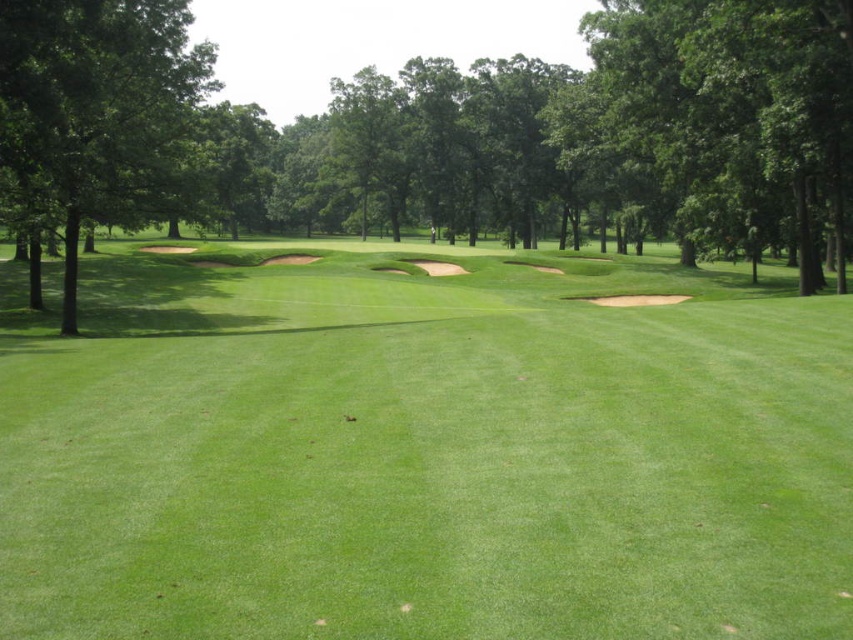
Is green grassy fairway at center below green leafy tree at left?

Indeed, green grassy fairway at center is positioned under green leafy tree at left.

What do you see at coordinates (422, 449) in the screenshot? The width and height of the screenshot is (853, 640). I see `green grassy fairway at center` at bounding box center [422, 449].

Who is more distant from viewer, (x=231, y=252) or (x=33, y=176)?

The point (x=231, y=252) is more distant.

Identify the location of green grassy fairway at center. (422, 449).

Is green leafy tree at center positioned in front of green leafy tree at left?

No, it is behind green leafy tree at left.

The width and height of the screenshot is (853, 640). What are the coordinates of `green leafy tree at center` in the screenshot? It's located at (444, 134).

At what (x,y) coordinates should I click in order to perform the action: click on green leafy tree at center. Please return your answer as a coordinate pair (x, y). This screenshot has height=640, width=853. Looking at the image, I should click on (444, 134).

Is green grassy fairway at center positioned behind green leafy tree at center?

That is False.

Looking at this image, is green grassy fairway at center bigger than green leafy tree at center?

Incorrect, green grassy fairway at center is not larger than green leafy tree at center.

Which is in front, point (381, 579) or point (390, 224)?

Point (381, 579)

Find the location of a particular element. This screenshot has height=640, width=853. green grassy fairway at center is located at coordinates (422, 449).